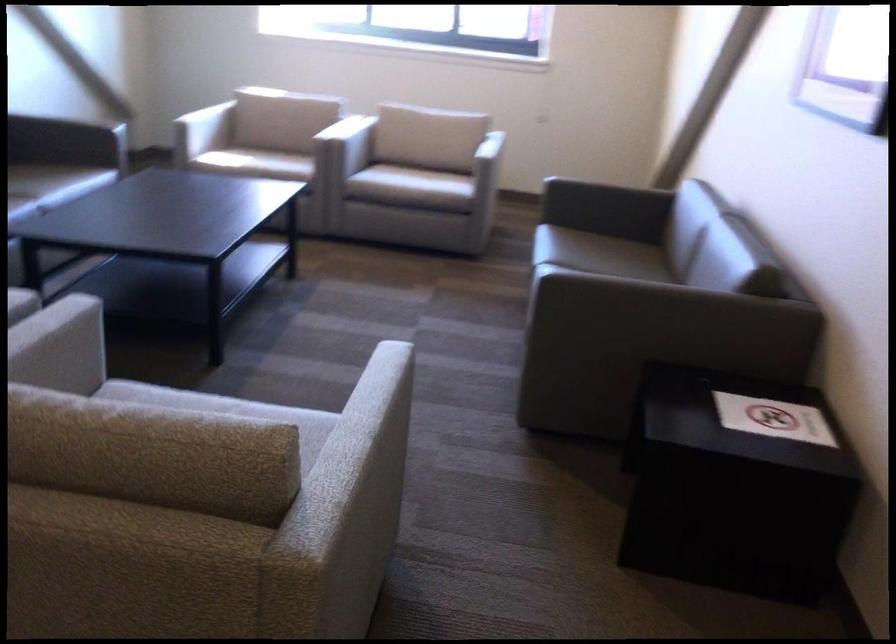
Where would you lift the small paper sign? Please return your answer as a coordinate pair (x, y).

(773, 418)